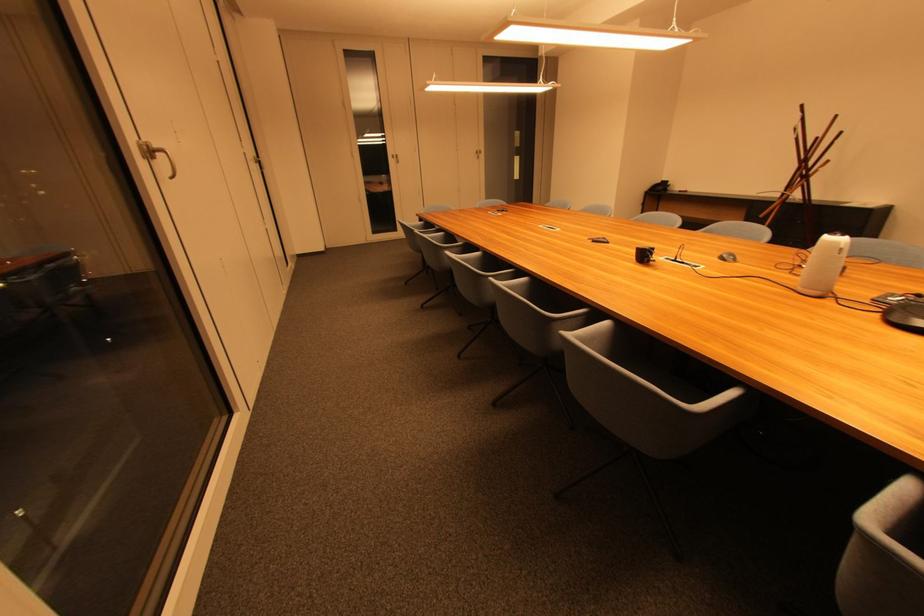
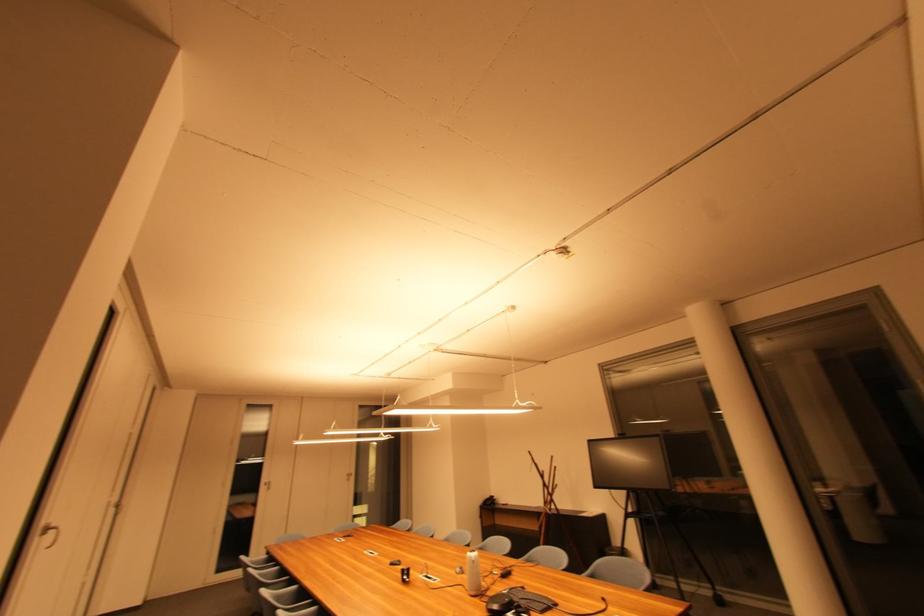
Find the pixel in the second image that matches (397,159) in the first image.

(271, 485)